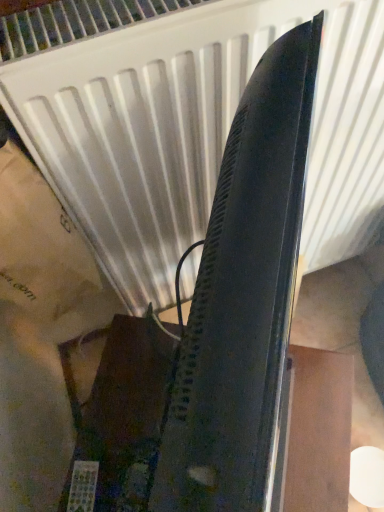
Image resolution: width=384 pixels, height=512 pixels. In order to click on glossy black television at center in this screenshot , I will do `click(243, 297)`.

The width and height of the screenshot is (384, 512). What do you see at coordinates (243, 297) in the screenshot?
I see `glossy black television at center` at bounding box center [243, 297].

Image resolution: width=384 pixels, height=512 pixels. In order to click on glossy black television at center in this screenshot , I will do `click(243, 297)`.